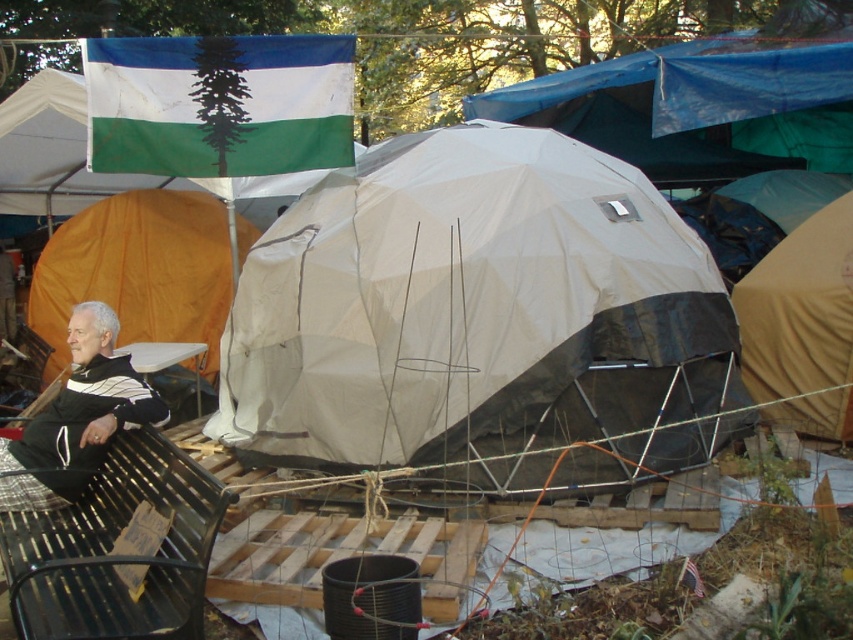
You are standing at the campsite and need to reach a specific location marked by the point at coordinates point (x=183, y=621). If your walking distance is limited to 10 feet, can you reach that point without moving further away?

The distance between you and the point (x=183, y=621) is 10.77 feet, which exceeds your 10 feet limit. Therefore, you cannot reach the point without moving further away.

You are setting up a campsite and need to determine which tent can accommodate more people. Based on the image, which tent has a larger width, the white tarpaulin tent at center or the beige fabric tent at right?

The white tarpaulin tent at center has a larger width than the beige fabric tent at right, so it can accommodate more people.

You are standing at the center of the campsite and want to find the white tarpaulin tent at center. According to the coordinates provided, where exactly should you look?

The white tarpaulin tent at center is located at coordinates point (480, 321), so you should look directly at that point to find it.